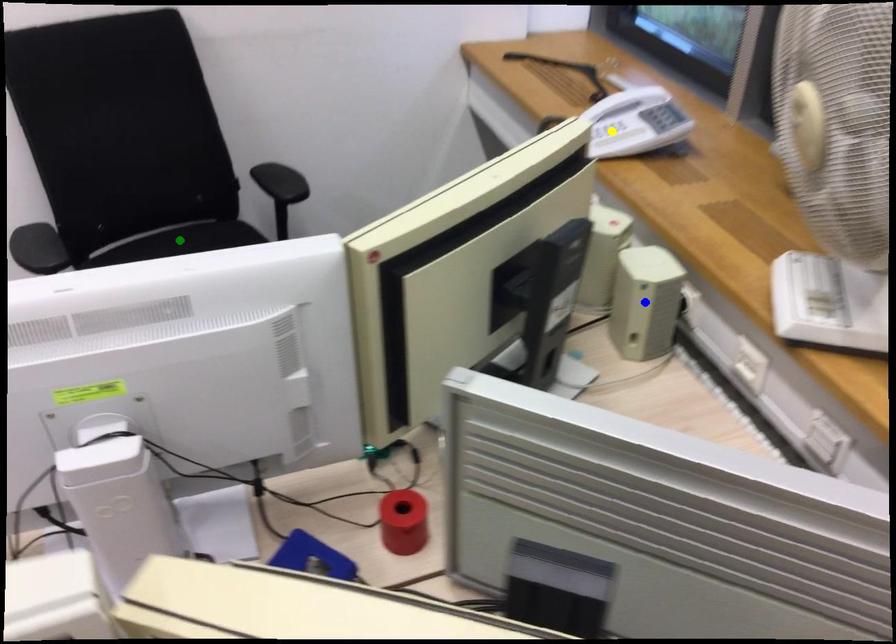
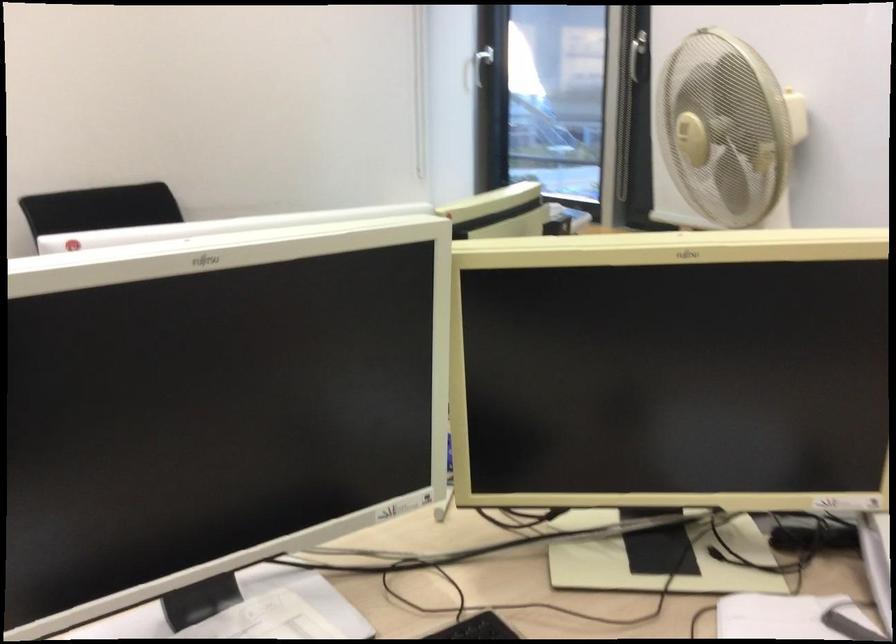
I am providing you with two images of the same scene from different viewpoints. Three points are marked in image1. Which point corresponds to a part or object that is occluded in image2?In image1, three points are marked. Which of them correspond to a part or object that is occluded in image2?Among the three points shown in image1, which one corresponds to a part or object that is no longer visible due to occlusion in image2?

yellow point, blue point, green point